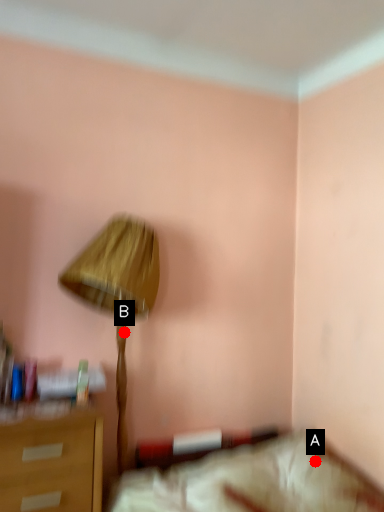
Question: Two points are circled on the image, labeled by A and B beside each circle. Among these points, which one is nearest to the camera?

Choices:
 (A) A is closer
 (B) B is closer

Answer: (A)